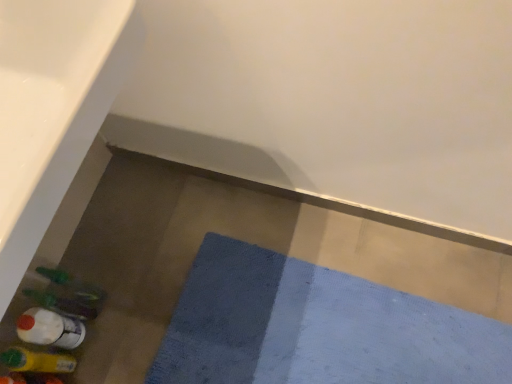
What is the approximate width of white glossy bath at lower left?

It is 17.60 inches.

You are a GUI agent. You are given a task and a screenshot of the screen. Output one action in this format:
    pyautogui.click(x=<x>, y=<y>)
    Task: Click on the translucent plastic bottle at lower left, the second bottle when ordered from bottom to top
    This screenshot has width=512, height=384.
    Given the screenshot: What is the action you would take?
    pyautogui.click(x=50, y=329)

What is the approximate width of translucent plastic bottle at lower left, which is the second bottle from top to bottom?

3.28 inches.

The width and height of the screenshot is (512, 384). What do you see at coordinates (37, 361) in the screenshot? I see `translucent plastic bottle at lower left, marked as the 1th bottle in a bottom-to-top arrangement` at bounding box center [37, 361].

I want to click on blue textured bath mat at lower center, so click(316, 328).

Consider the image. Can you tell me how much translucent plastic bottle at lower left, which is the second bottle from top to bottom, and translucent plastic bottle at lower left, arranged as the first bottle when viewed from the top, differ in facing direction?

The angular difference between translucent plastic bottle at lower left, which is the second bottle from top to bottom, and translucent plastic bottle at lower left, arranged as the first bottle when viewed from the top, is 0.00103 degrees.

Considering the relative sizes of translucent plastic bottle at lower left, which is the second bottle from top to bottom, and translucent plastic bottle at lower left, arranged as the first bottle when viewed from the top, in the image provided, is translucent plastic bottle at lower left, which is the second bottle from top to bottom, wider than translucent plastic bottle at lower left, arranged as the first bottle when viewed from the top,?

No.

In the scene shown: Is translucent plastic bottle at lower left, the second bottle when ordered from bottom to top, not close to translucent plastic bottle at lower left, the 3th bottle positioned from the bottom?

Actually, translucent plastic bottle at lower left, the second bottle when ordered from bottom to top, and translucent plastic bottle at lower left, the 3th bottle positioned from the bottom, are a little close together.

How far apart are translucent plastic bottle at lower left, the second bottle when ordered from bottom to top, and translucent plastic bottle at lower left, arranged as the first bottle when viewed from the top?

translucent plastic bottle at lower left, the second bottle when ordered from bottom to top, is 2.43 inches away from translucent plastic bottle at lower left, arranged as the first bottle when viewed from the top.

Is translucent plastic bottle at lower left, marked as the 1th bottle in a bottom-to-top arrangement, directly adjacent to white glossy bath at lower left?

No, translucent plastic bottle at lower left, marked as the 1th bottle in a bottom-to-top arrangement, is not next to white glossy bath at lower left.

Is translucent plastic bottle at lower left, marked as the 1th bottle in a bottom-to-top arrangement, oriented away from white glossy bath at lower left?

No, translucent plastic bottle at lower left, marked as the 1th bottle in a bottom-to-top arrangement,'s orientation is not away from white glossy bath at lower left.

From a real-world perspective, which object rests below the other?

translucent plastic bottle at lower left, marked as the 1th bottle in a bottom-to-top arrangement, from a real-world perspective.

Between translucent plastic bottle at lower left, which ranks as the 3th bottle in top-to-bottom order, and white glossy bath at lower left, which one has larger width?

white glossy bath at lower left is wider.

Considering the relative sizes of translucent plastic bottle at lower left, arranged as the first bottle when viewed from the top, and white glossy bath at lower left in the image provided, is translucent plastic bottle at lower left, arranged as the first bottle when viewed from the top, shorter than white glossy bath at lower left?

No.

Considering the positions of objects translucent plastic bottle at lower left, the 3th bottle positioned from the bottom, and white glossy bath at lower left in the image provided, who is more to the right, translucent plastic bottle at lower left, the 3th bottle positioned from the bottom, or white glossy bath at lower left?

white glossy bath at lower left.

In terms of size, does translucent plastic bottle at lower left, arranged as the first bottle when viewed from the top, appear bigger or smaller than white glossy bath at lower left?

Clearly, translucent plastic bottle at lower left, arranged as the first bottle when viewed from the top, is smaller in size than white glossy bath at lower left.

From the picture: Is blue textured bath mat at lower center with white glossy bath at lower left?

No, blue textured bath mat at lower center is not with white glossy bath at lower left.

Between blue textured bath mat at lower center and white glossy bath at lower left, which one is positioned behind?

blue textured bath mat at lower center.

Considering the sizes of objects blue textured bath mat at lower center and white glossy bath at lower left in the image provided, who is smaller, blue textured bath mat at lower center or white glossy bath at lower left?

blue textured bath mat at lower center is smaller.

From the image's perspective, is blue textured bath mat at lower center on top of white glossy bath at lower left?

No, from the image's perspective, blue textured bath mat at lower center is not above white glossy bath at lower left.

Is translucent plastic bottle at lower left, which ranks as the 3th bottle in top-to-bottom order, placed right next to translucent plastic bottle at lower left, arranged as the first bottle when viewed from the top?

translucent plastic bottle at lower left, which ranks as the 3th bottle in top-to-bottom order, and translucent plastic bottle at lower left, arranged as the first bottle when viewed from the top, are clearly separated.

From the image's perspective, which one is positioned higher, translucent plastic bottle at lower left, which ranks as the 3th bottle in top-to-bottom order, or translucent plastic bottle at lower left, the 3th bottle positioned from the bottom?

translucent plastic bottle at lower left, the 3th bottle positioned from the bottom, is shown above in the image.

Is translucent plastic bottle at lower left, arranged as the first bottle when viewed from the top, located within translucent plastic bottle at lower left, which ranks as the 3th bottle in top-to-bottom order?

No, translucent plastic bottle at lower left, arranged as the first bottle when viewed from the top, is not inside translucent plastic bottle at lower left, which ranks as the 3th bottle in top-to-bottom order.

Considering the relative positions of translucent plastic bottle at lower left, marked as the 1th bottle in a bottom-to-top arrangement, and translucent plastic bottle at lower left, the 3th bottle positioned from the bottom, in the image provided, is translucent plastic bottle at lower left, marked as the 1th bottle in a bottom-to-top arrangement, to the left or to the right of translucent plastic bottle at lower left, the 3th bottle positioned from the bottom,?

Based on their positions, translucent plastic bottle at lower left, marked as the 1th bottle in a bottom-to-top arrangement, is located to the left of translucent plastic bottle at lower left, the 3th bottle positioned from the bottom.

Which is behind, white glossy bath at lower left or blue textured bath mat at lower center?

blue textured bath mat at lower center is behind.

Does white glossy bath at lower left have a lesser width compared to blue textured bath mat at lower center?

Correct, the width of white glossy bath at lower left is less than that of blue textured bath mat at lower center.

Does white glossy bath at lower left turn towards blue textured bath mat at lower center?

No, white glossy bath at lower left is not aimed at blue textured bath mat at lower center.

Where is `bath mat below the translucent plastic bottle at lower left, which is the second bottle from top to bottom (from the image's perspective)`? The height and width of the screenshot is (384, 512). bath mat below the translucent plastic bottle at lower left, which is the second bottle from top to bottom (from the image's perspective) is located at coordinates (316, 328).

Which is correct: blue textured bath mat at lower center is inside translucent plastic bottle at lower left, the second bottle when ordered from bottom to top, or outside of it?

blue textured bath mat at lower center cannot be found inside translucent plastic bottle at lower left, the second bottle when ordered from bottom to top.

How distant is blue textured bath mat at lower center from translucent plastic bottle at lower left, which is the second bottle from top to bottom?

A distance of 23.12 inches exists between blue textured bath mat at lower center and translucent plastic bottle at lower left, which is the second bottle from top to bottom.

From the image's perspective, between blue textured bath mat at lower center and translucent plastic bottle at lower left, which is the second bottle from top to bottom, who is located below?

blue textured bath mat at lower center, from the image's perspective.

From the translucent plastic bottle at lower left, the 3th bottle positioned from the bottom, count 1st bottles forward and point to it. Please provide its 2D coordinates.

[(50, 329)]

This screenshot has height=384, width=512. There is a white glossy bath at lower left. In order to click on the 1st bottle below it (from a real-world perspective) in this screenshot , I will do `click(37, 361)`.

Looking at the image, which one is located further to translucent plastic bottle at lower left, which is the second bottle from top to bottom, white glossy bath at lower left or translucent plastic bottle at lower left, which ranks as the 3th bottle in top-to-bottom order?

white glossy bath at lower left lies further to translucent plastic bottle at lower left, which is the second bottle from top to bottom, than the other object.

Which object lies further to the anchor point blue textured bath mat at lower center, white glossy bath at lower left or translucent plastic bottle at lower left, the 3th bottle positioned from the bottom?

The object further to blue textured bath mat at lower center is white glossy bath at lower left.

Which object lies further to the anchor point white glossy bath at lower left, translucent plastic bottle at lower left, which ranks as the 3th bottle in top-to-bottom order, or translucent plastic bottle at lower left, which is the second bottle from top to bottom?

translucent plastic bottle at lower left, which ranks as the 3th bottle in top-to-bottom order, is further to white glossy bath at lower left.

From the image, which object appears to be farther from translucent plastic bottle at lower left, marked as the 1th bottle in a bottom-to-top arrangement, blue textured bath mat at lower center or white glossy bath at lower left?

white glossy bath at lower left lies further to translucent plastic bottle at lower left, marked as the 1th bottle in a bottom-to-top arrangement, than the other object.

From the image, which object appears to be nearer to white glossy bath at lower left, blue textured bath mat at lower center or translucent plastic bottle at lower left, which is the second bottle from top to bottom?

translucent plastic bottle at lower left, which is the second bottle from top to bottom, lies closer to white glossy bath at lower left than the other object.

Considering their positions, is translucent plastic bottle at lower left, the second bottle when ordered from bottom to top, positioned further to blue textured bath mat at lower center than translucent plastic bottle at lower left, the 3th bottle positioned from the bottom?

translucent plastic bottle at lower left, the 3th bottle positioned from the bottom, is positioned further to the anchor blue textured bath mat at lower center.

Looking at the image, which one is located further to translucent plastic bottle at lower left, which ranks as the 3th bottle in top-to-bottom order, translucent plastic bottle at lower left, arranged as the first bottle when viewed from the top, or white glossy bath at lower left?

white glossy bath at lower left lies further to translucent plastic bottle at lower left, which ranks as the 3th bottle in top-to-bottom order, than the other object.

Based on their spatial positions, is blue textured bath mat at lower center or translucent plastic bottle at lower left, the second bottle when ordered from bottom to top, closer to translucent plastic bottle at lower left, the 3th bottle positioned from the bottom?

translucent plastic bottle at lower left, the second bottle when ordered from bottom to top, is positioned closer to the anchor translucent plastic bottle at lower left, the 3th bottle positioned from the bottom.

Image resolution: width=512 pixels, height=384 pixels. What are the coordinates of `bath situated between translucent plastic bottle at lower left, arranged as the first bottle when viewed from the top, and blue textured bath mat at lower center from left to right` in the screenshot? It's located at (52, 109).

The image size is (512, 384). Identify the location of bottle between translucent plastic bottle at lower left, arranged as the first bottle when viewed from the top, and translucent plastic bottle at lower left, which ranks as the 3th bottle in top-to-bottom order, in the up-down direction. (50, 329).

Find the location of `bottle between translucent plastic bottle at lower left, the second bottle when ordered from bottom to top, and blue textured bath mat at lower center, in the horizontal direction`. bottle between translucent plastic bottle at lower left, the second bottle when ordered from bottom to top, and blue textured bath mat at lower center, in the horizontal direction is located at coordinates (62, 304).

Where is `bath between translucent plastic bottle at lower left, which ranks as the 3th bottle in top-to-bottom order, and blue textured bath mat at lower center, in the horizontal direction`? bath between translucent plastic bottle at lower left, which ranks as the 3th bottle in top-to-bottom order, and blue textured bath mat at lower center, in the horizontal direction is located at coordinates (52, 109).